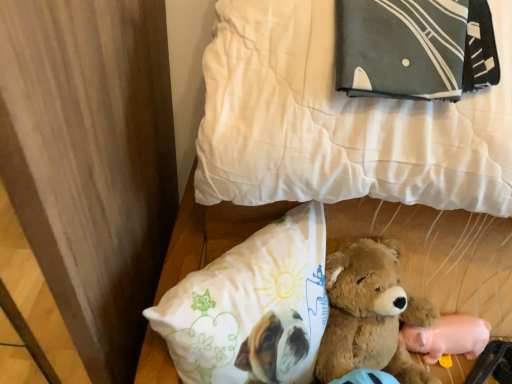
Question: Considering the positions of white quilted bed at upper center and white fabric pillow at lower center, which is the 2th pillow in top-to-bottom order, in the image, is white quilted bed at upper center taller or shorter than white fabric pillow at lower center, which is the 2th pillow in top-to-bottom order,?

Choices:
 (A) short
 (B) tall

Answer: (B)

Question: From the image's perspective, is white quilted bed at upper center located above or below white fabric pillow at lower center, arranged as the 1th pillow when ordered from the bottom?

Choices:
 (A) above
 (B) below

Answer: (A)

Question: Which object is the closest to the white soft pillow at upper center, the 1th pillow when ordered from top to bottom?

Choices:
 (A) white fabric pillow at lower center, which is the 2th pillow in top-to-bottom order
 (B) pink rubber pig at lower right
 (C) white quilted bed at upper center

Answer: (C)

Question: Which is nearer to the white quilted bed at upper center?

Choices:
 (A) pink rubber pig at lower right
 (B) white fabric pillow at lower center, which is the 2th pillow in top-to-bottom order
 (C) white soft pillow at upper center, placed as the 2th pillow when sorted from bottom to top

Answer: (C)